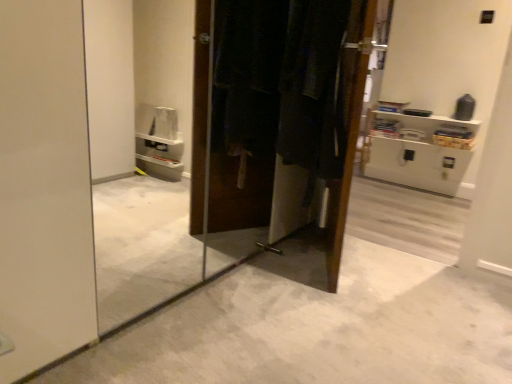
Question: Do you think dark fabric laundry at center is within white plastic shelf at upper right, or outside of it?

Choices:
 (A) inside
 (B) outside

Answer: (B)

Question: From the image's perspective, is dark fabric laundry at center located above or below white plastic shelf at upper right?

Choices:
 (A) below
 (B) above

Answer: (A)

Question: Based on their sizes in the image, would you say dark fabric laundry at center is bigger or smaller than white plastic shelf at upper right?

Choices:
 (A) small
 (B) big

Answer: (B)

Question: Considering the positions of white plastic shelf at upper right and dark fabric laundry at center in the image, is white plastic shelf at upper right taller or shorter than dark fabric laundry at center?

Choices:
 (A) tall
 (B) short

Answer: (B)

Question: Choose the correct answer: Is white plastic shelf at upper right inside dark fabric laundry at center or outside it?

Choices:
 (A) inside
 (B) outside

Answer: (B)

Question: From the image's perspective, is white plastic shelf at upper right positioned above or below dark fabric laundry at center?

Choices:
 (A) below
 (B) above

Answer: (B)

Question: Is white plastic shelf at upper right in front of or behind dark fabric laundry at center in the image?

Choices:
 (A) behind
 (B) front

Answer: (A)